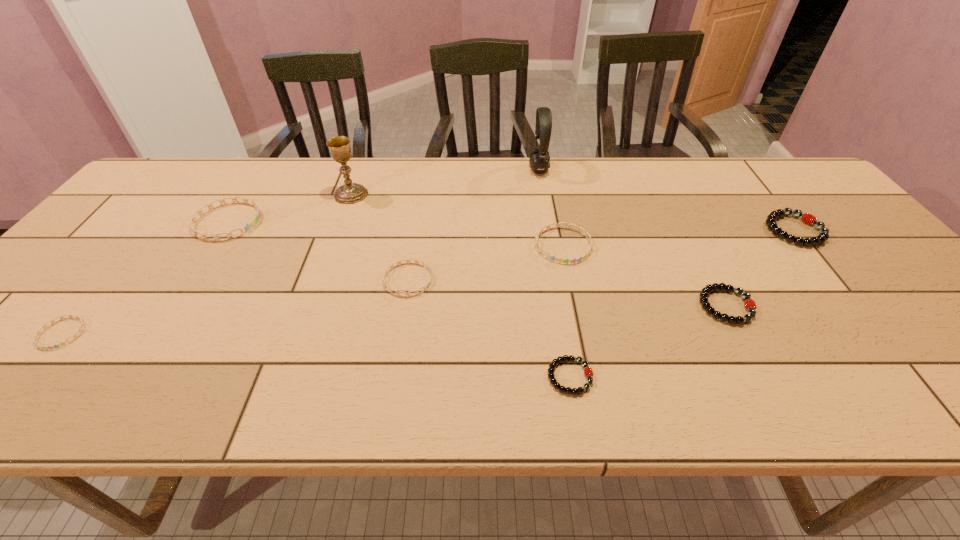
Find the location of a particular element. This screenshot has width=960, height=540. object at the left edge is located at coordinates (83, 323).

In order to click on object that is positioned at the right edge in this screenshot , I will do point(807,218).

Identify the location of free spot at the far edge of the desktop. (498, 187).

Where is `vacant space at the near edge of the desktop`? vacant space at the near edge of the desktop is located at coordinates (59, 392).

Where is `blank space at the left edge of the desktop`? blank space at the left edge of the desktop is located at coordinates (107, 269).

Find the location of a particular element. The width and height of the screenshot is (960, 540). vacant region at the right edge of the desktop is located at coordinates (933, 316).

Find the location of `free location at the far right corner`. free location at the far right corner is located at coordinates (768, 181).

At what (x,y) coordinates should I click in order to perform the action: click on unoccupied position between the chalice and the biggest black bracelet. Please return your answer as a coordinate pair (x, y). The width and height of the screenshot is (960, 540). Looking at the image, I should click on (573, 212).

At what (x,y) coordinates should I click in order to perform the action: click on unoccupied position between the farthest object and the eighth object from left to right. Please return your answer as a coordinate pair (x, y). Looking at the image, I should click on 633,238.

What are the coordinates of `vacant area between the nearest black bracelet and the second object from left to right` in the screenshot? It's located at (398, 299).